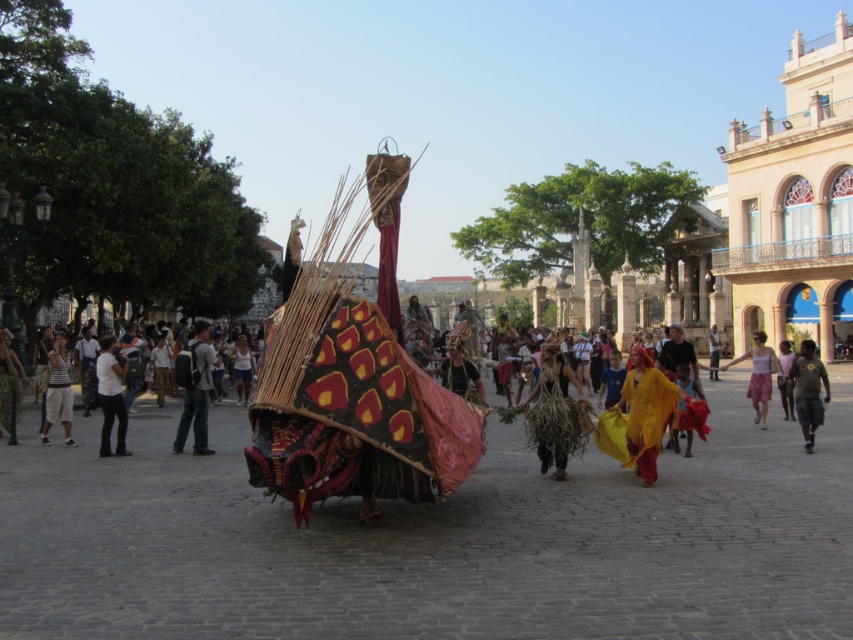
Consider the image. You are a photographer trying to capture the cultural event. You notice two participants wearing the white cotton shirt at center and the brown cotton shirt at right. Which participant would you ask to move closer to the camera if you want to make their shirt appear larger in the photo?

The brown cotton shirt at right should be moved closer to the camera because it has a greater width than the white cotton shirt at center, so moving it closer will make it appear larger in the photo.